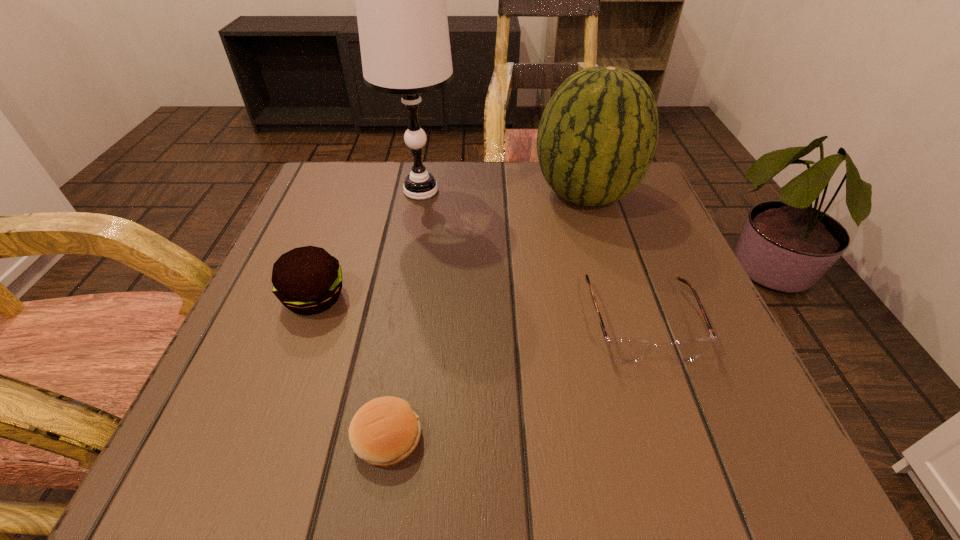
In order to click on table lamp in this screenshot , I will do `click(400, 0)`.

Locate an element on the screen. the fourth shortest object is located at coordinates (597, 137).

I want to click on the left patty, so click(x=307, y=280).

You are a GUI agent. You are given a task and a screenshot of the screen. Output one action in this format:
    pyautogui.click(x=<x>, y=<y>)
    Task: Click on the farther patty
    The height and width of the screenshot is (540, 960).
    Given the screenshot: What is the action you would take?
    pyautogui.click(x=307, y=280)

The width and height of the screenshot is (960, 540). Find the location of `the fourth tallest object`. the fourth tallest object is located at coordinates (625, 349).

Where is `the shortest object`? The height and width of the screenshot is (540, 960). the shortest object is located at coordinates (384, 431).

This screenshot has height=540, width=960. What are the coordinates of `the nearest object` in the screenshot? It's located at (384, 431).

Locate an element on the screen. The height and width of the screenshot is (540, 960). vacant space situated on the right of the table lamp is located at coordinates (603, 191).

Where is `vacant space situated 0.170m on the left of the fourth shortest object`? The height and width of the screenshot is (540, 960). vacant space situated 0.170m on the left of the fourth shortest object is located at coordinates (456, 195).

Identify the location of free space located 0.180m on the front of the leftmost object. The height and width of the screenshot is (540, 960). (267, 427).